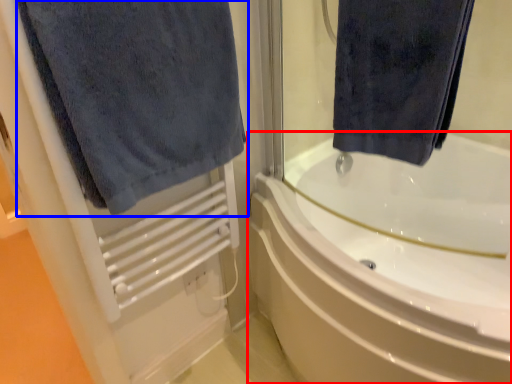
Question: Among these objects, which one is farthest to the camera, bathtub (highlighted by a red box) or towel (highlighted by a blue box)?

Choices:
 (A) bathtub
 (B) towel

Answer: (A)